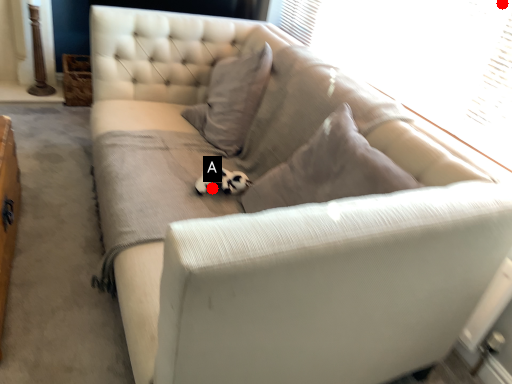
Question: Two points are circled on the image, labeled by A and B beside each circle. Which point is closer to the camera?

Choices:
 (A) A is closer
 (B) B is closer

Answer: (B)